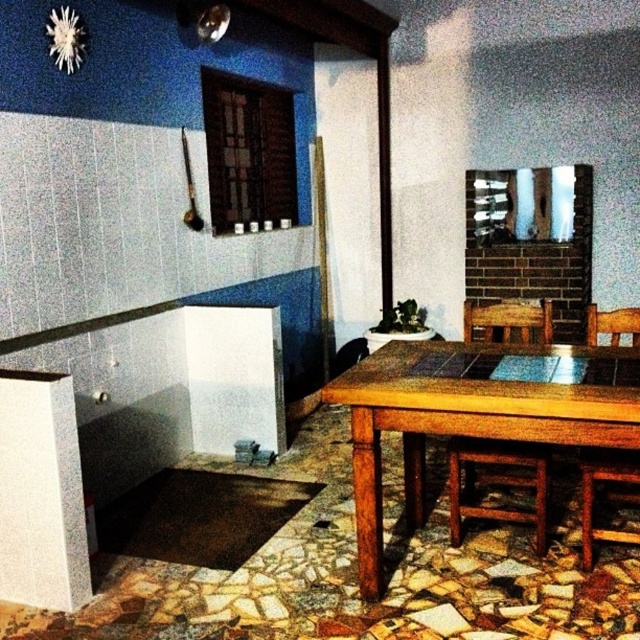
Can you confirm if wooden table at center is positioned above wooden chair at lower right?

Yes, wooden table at center is above wooden chair at lower right.

Is point (528, 374) positioned behind point (586, 515)?

No, it is not.

Which is in front, point (417, 385) or point (637, 534)?

Point (417, 385) is more forward.

The image size is (640, 640). What are the coordinates of `wooden table at center` in the screenshot? It's located at (476, 412).

Between wooden chair at center and wooden chair at lower right, which one has more height?

Standing taller between the two is wooden chair at center.

Measure the distance between wooden chair at center and wooden chair at lower right.

They are 39.60 centimeters apart.

Who is more forward, (545,301) or (616,332)?

Positioned in front is point (616,332).

Where is `wooden chair at center`? The height and width of the screenshot is (640, 640). wooden chair at center is located at coordinates (497, 483).

Does wooden table at center have a smaller size compared to wooden chair at center?

Incorrect, wooden table at center is not smaller in size than wooden chair at center.

This screenshot has height=640, width=640. What do you see at coordinates (476, 412) in the screenshot?
I see `wooden table at center` at bounding box center [476, 412].

Where is `wooden table at center`? wooden table at center is located at coordinates (476, 412).